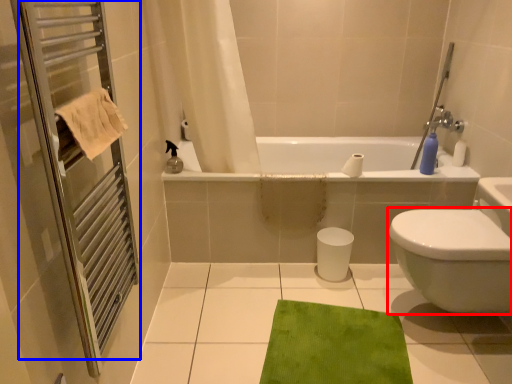
Question: Among these objects, which one is farthest to the camera, bidet (highlighted by a red box) or screen door (highlighted by a blue box)?

Choices:
 (A) bidet
 (B) screen door

Answer: (A)